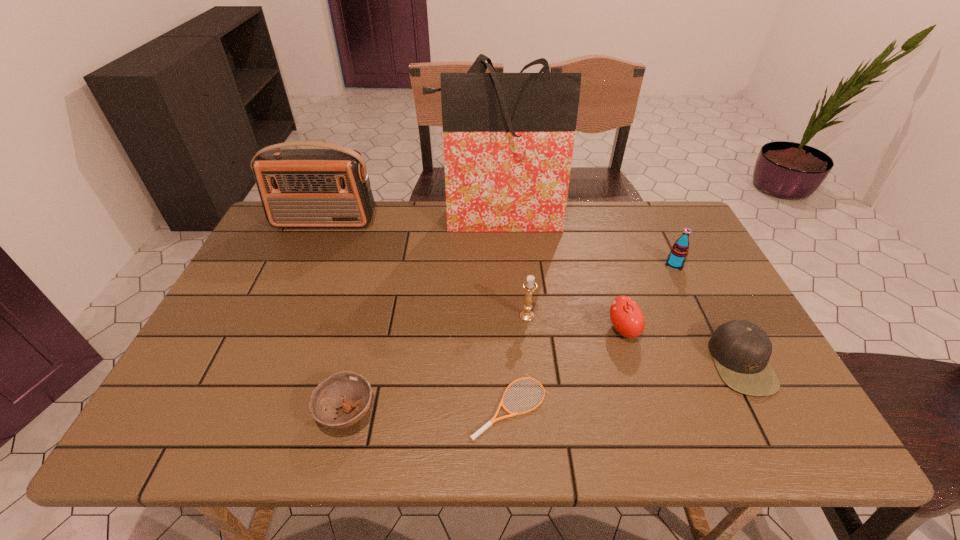
Identify the location of shopping bag. (508, 138).

I want to click on radio receiver, so click(x=310, y=187).

Where is `candle holder`? The image size is (960, 540). candle holder is located at coordinates (529, 286).

Where is `the sixth nearest object`? The height and width of the screenshot is (540, 960). the sixth nearest object is located at coordinates (679, 251).

Where is `the fourth shortest object`? The image size is (960, 540). the fourth shortest object is located at coordinates (626, 316).

Find the location of `apple`. apple is located at coordinates (626, 316).

At what (x,y) coordinates should I click in order to perform the action: click on the sixth tallest object. Please return your answer as a coordinate pair (x, y). Image resolution: width=960 pixels, height=540 pixels. Looking at the image, I should click on (741, 350).

Where is `bowl`? bowl is located at coordinates (346, 389).

Where is `the shortest object`? Image resolution: width=960 pixels, height=540 pixels. the shortest object is located at coordinates (493, 420).

Locate an element on the screen. The height and width of the screenshot is (540, 960). vacant space positioned on the front side of the shopping bag is located at coordinates (498, 248).